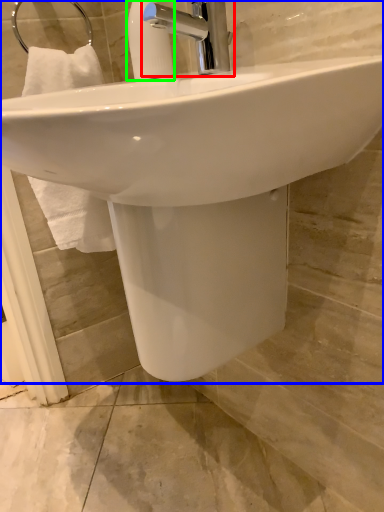
Question: Which is nearer to the tap (highlighted by a red box)? sink (highlighted by a blue box) or soap dispenser (highlighted by a green box).

Choices:
 (A) sink
 (B) soap dispenser

Answer: (B)